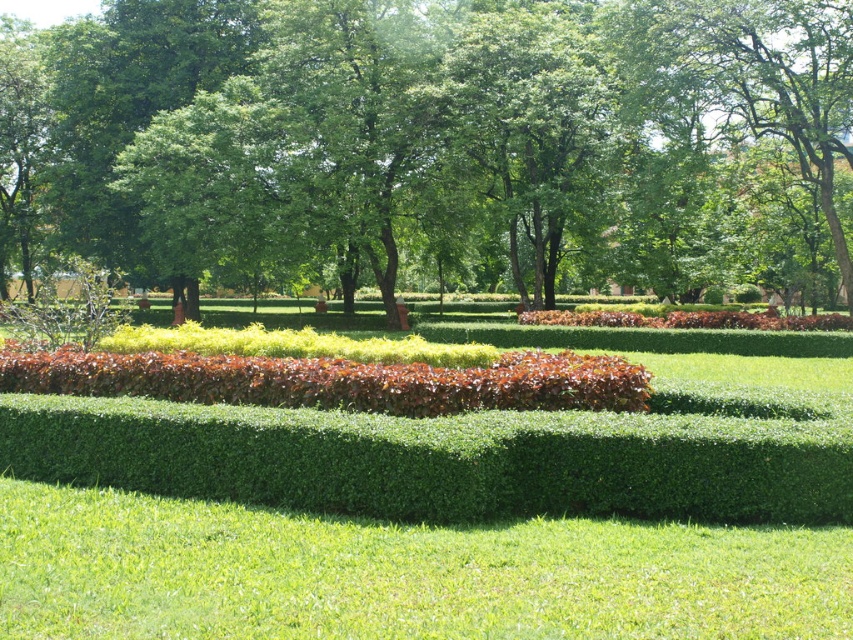
Question: Among these points, which one is farthest from the camera?

Choices:
 (A) (155, 144)
 (B) (555, 381)

Answer: (A)

Question: Observing the image, what is the correct spatial positioning of green leafy grass at center in reference to green smooth grass at center?

Choices:
 (A) left
 (B) right

Answer: (A)

Question: Estimate the real-world distances between objects in this image. Which object is closer to the brown textured shrubbery at center?

Choices:
 (A) green leafy grass at center
 (B) green leafy tree at center

Answer: (A)

Question: Is green leafy tree at center behind brown textured shrubbery at center?

Choices:
 (A) yes
 (B) no

Answer: (A)

Question: Can you confirm if green leafy tree at center is positioned above brown textured shrubbery at center?

Choices:
 (A) no
 (B) yes

Answer: (B)

Question: Which point is closer to the camera?

Choices:
 (A) green smooth grass at center
 (B) brown textured shrubbery at center
 (C) green leafy tree at center
 (D) green leafy grass at center

Answer: (A)